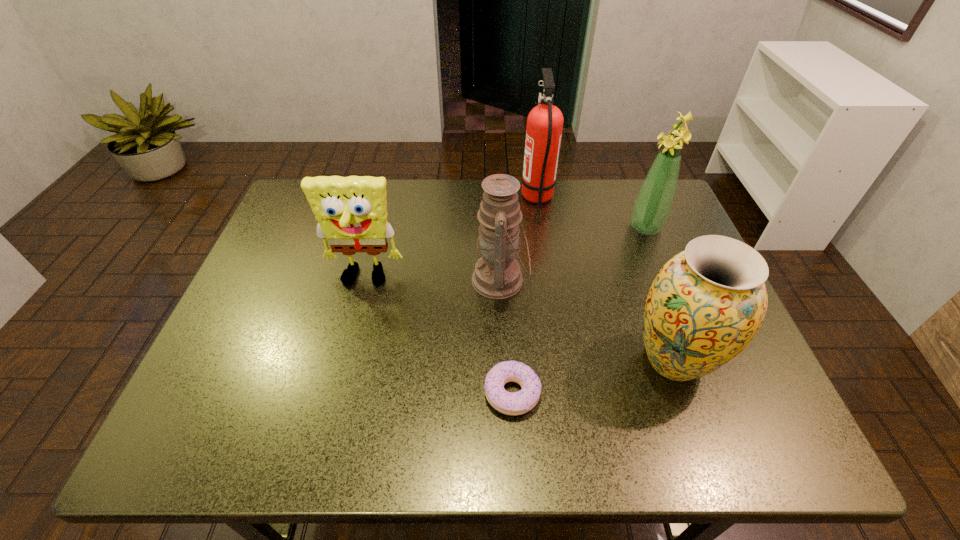
Locate an element on the screen. This screenshot has height=540, width=960. empty location between the third object from right to left and the vase is located at coordinates (606, 279).

Identify the location of empty space between the doughnut and the vase. (592, 377).

Identify the location of vacant region between the oil lamp and the bouquet. (573, 254).

At what (x,y) coordinates should I click in order to perform the action: click on unoccupied position between the vase and the oil lamp. Please return your answer as a coordinate pair (x, y). The width and height of the screenshot is (960, 540). Looking at the image, I should click on (587, 320).

Identify the location of empty space that is in between the doughnut and the second farthest object. Image resolution: width=960 pixels, height=540 pixels. (579, 310).

Where is `free space between the shortest object and the second farthest object`? The image size is (960, 540). free space between the shortest object and the second farthest object is located at coordinates (579, 310).

I want to click on unoccupied area between the fire extinguisher and the fifth nearest object, so click(591, 213).

Identify which object is the fourth nearest to the second farthest object. Please provide its 2D coordinates. Your answer should be formatted as a tuple, i.e. [(x, y)], where the tuple contains the x and y coordinates of a point satisfying the conditions above.

[(517, 403)]

Choose which object is the fourth nearest neighbor to the oil lamp. Please provide its 2D coordinates. Your answer should be formatted as a tuple, i.e. [(x, y)], where the tuple contains the x and y coordinates of a point satisfying the conditions above.

[(706, 304)]

Locate an element on the screen. vacant point that satisfies the following two spatial constraints: 1. on the face of the sponge; 2. on the right side of the oil lamp is located at coordinates (364, 280).